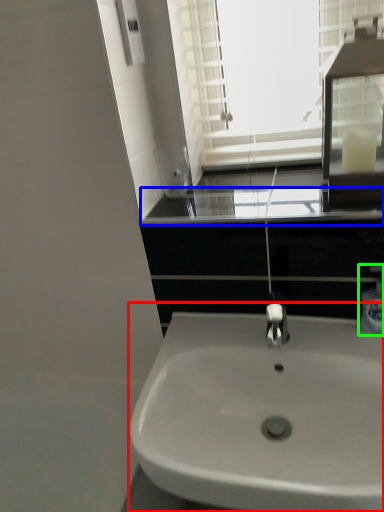
Question: Estimate the real-world distances between objects in this image. Which object is closer to sink (highlighted by a red box), window sill (highlighted by a blue box) or soap dispenser (highlighted by a green box)?

Choices:
 (A) window sill
 (B) soap dispenser

Answer: (B)